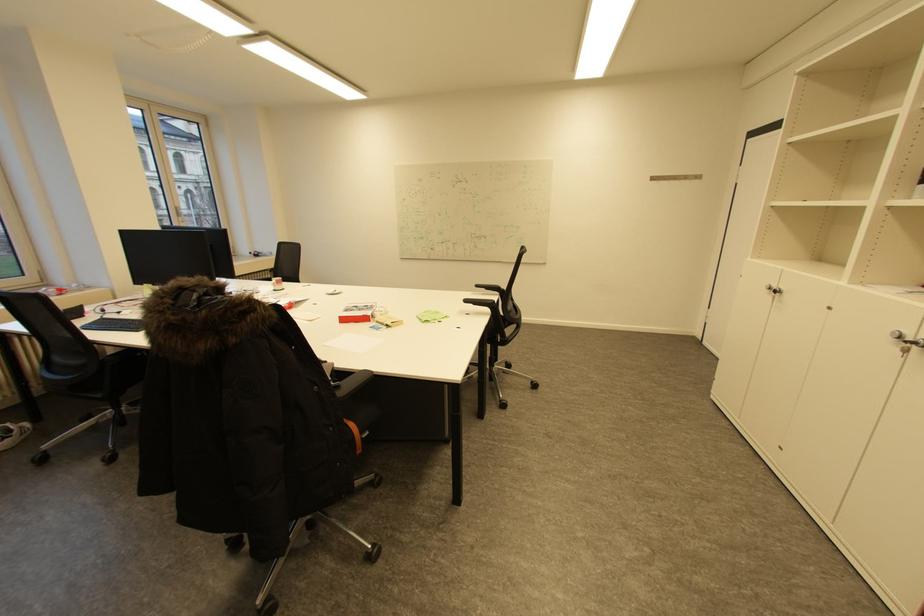
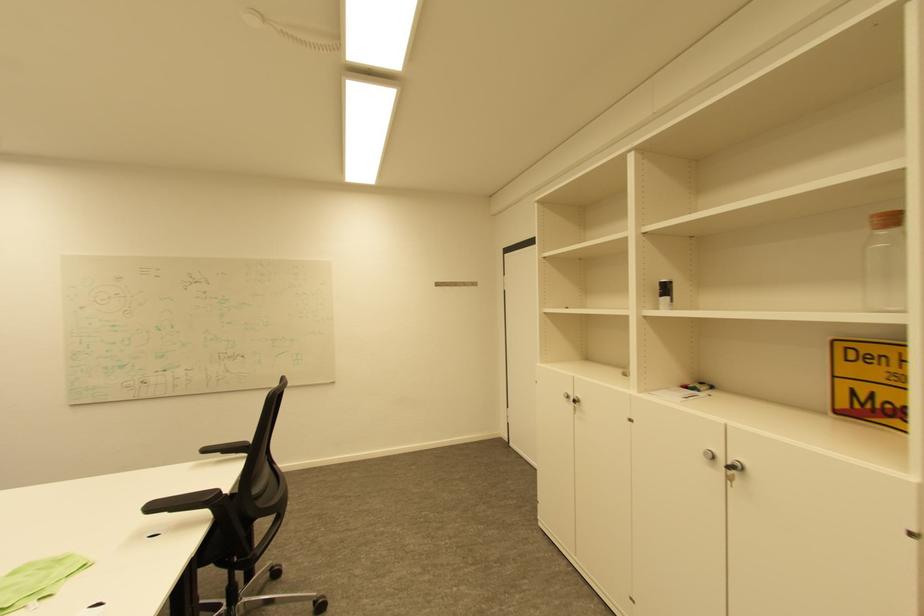
In the second image, find the point that corresponds to the point at 484,286 in the first image.

(213, 450)